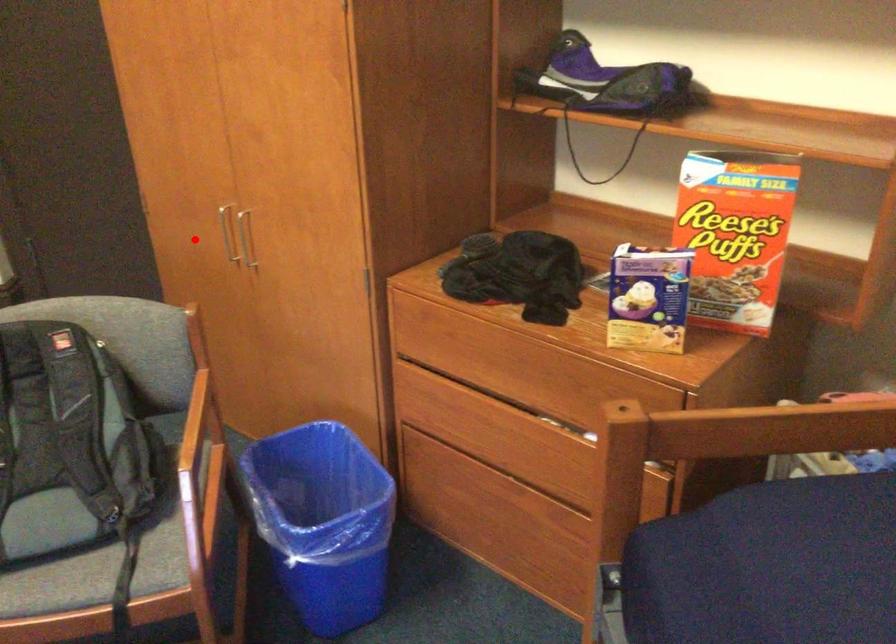
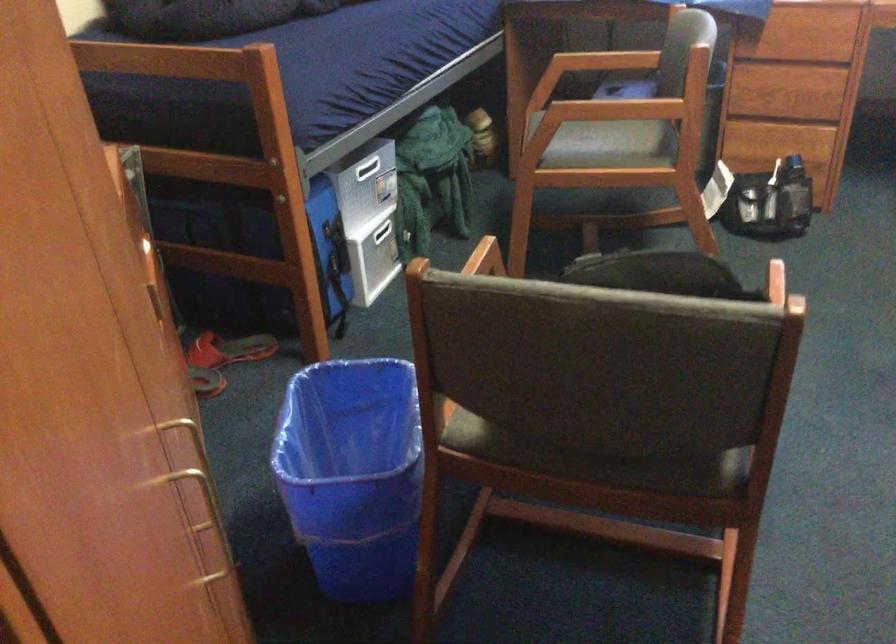
Find the pixel in the second image that matches the highlighted location in the first image.

(199, 494)